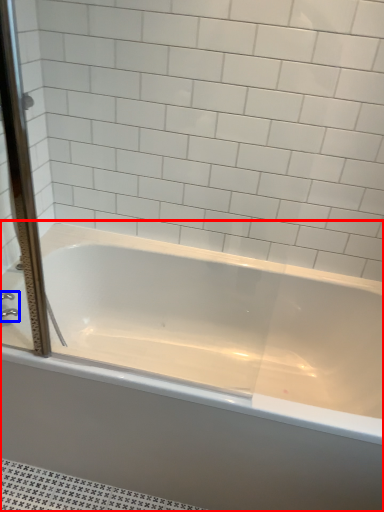
Question: Among these objects, which one is farthest to the camera, bathtub (highlighted by a red box) or faucet (highlighted by a blue box)?

Choices:
 (A) bathtub
 (B) faucet

Answer: (B)